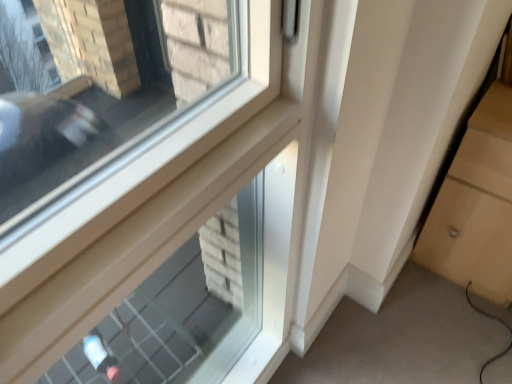
Identify the location of light wood dresser at lower right. (477, 196).

Describe the element at coordinates (477, 196) in the screenshot. The height and width of the screenshot is (384, 512). I see `light wood dresser at lower right` at that location.

What are the coordinates of `light wood dresser at lower right` in the screenshot? It's located at (477, 196).